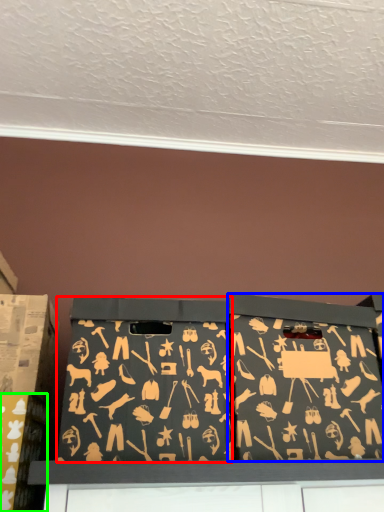
Question: Based on their relative distances, which object is nearer to box (highlighted by a red box)? Choose from box (highlighted by a blue box) and box (highlighted by a green box).

Choices:
 (A) box
 (B) box

Answer: (A)